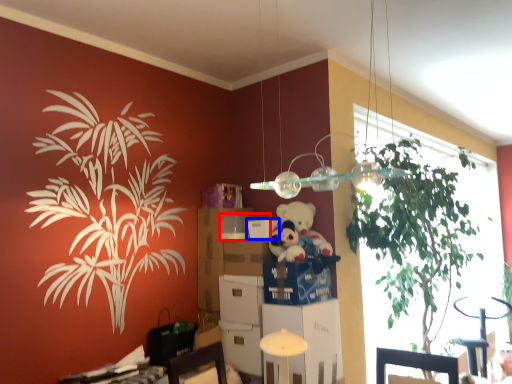
Question: Among these objects, which one is farthest to the camera, box (highlighted by a red box) or box (highlighted by a blue box)?

Choices:
 (A) box
 (B) box

Answer: (A)